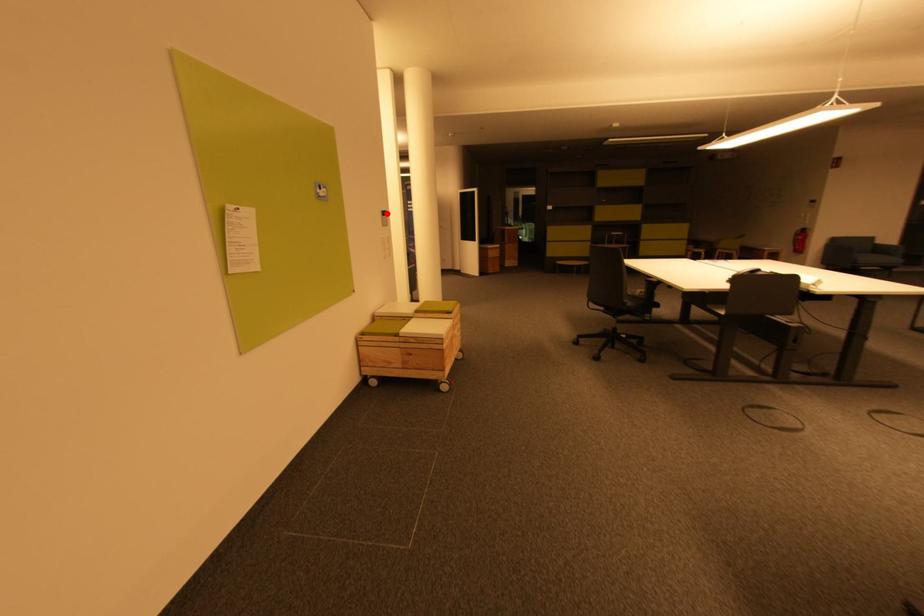
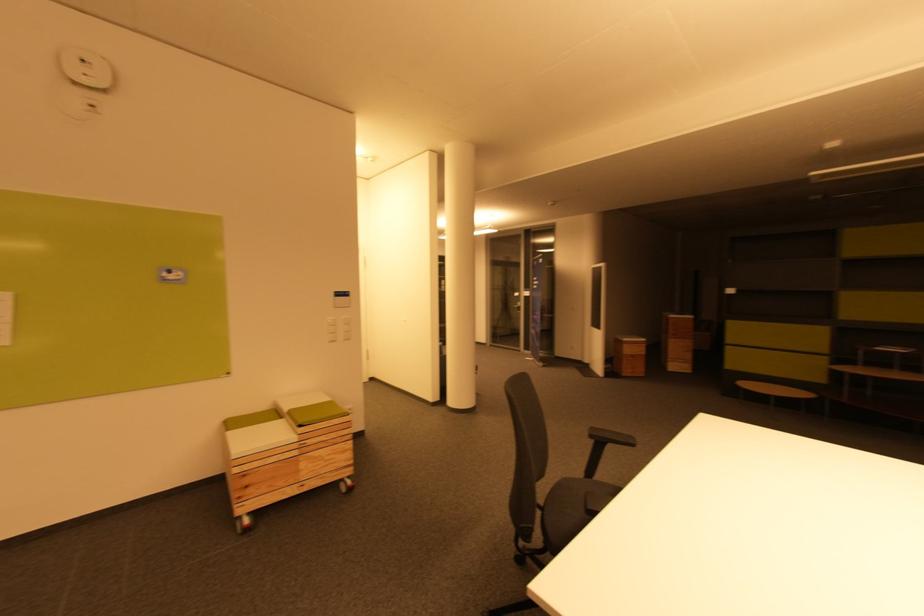
Question: I am providing you with two images of the same scene from different viewpoints. A red point is shown in image1. For the corresponding object point in image2, is it positioned nearer or farther from the camera?

Choices:
 (A) Nearer
 (B) Farther

Answer: (B)